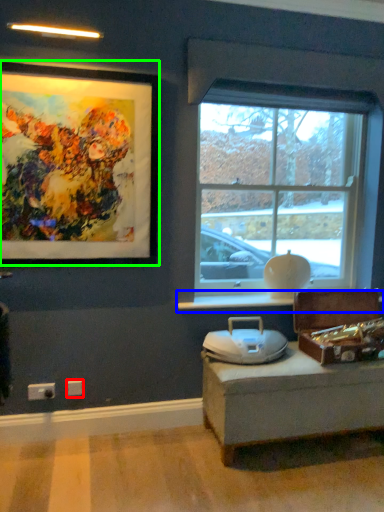
Question: Which is nearer to the electric outlet (highlighted by a red box)? window sill (highlighted by a blue box) or picture frame (highlighted by a green box).

Choices:
 (A) window sill
 (B) picture frame

Answer: (A)